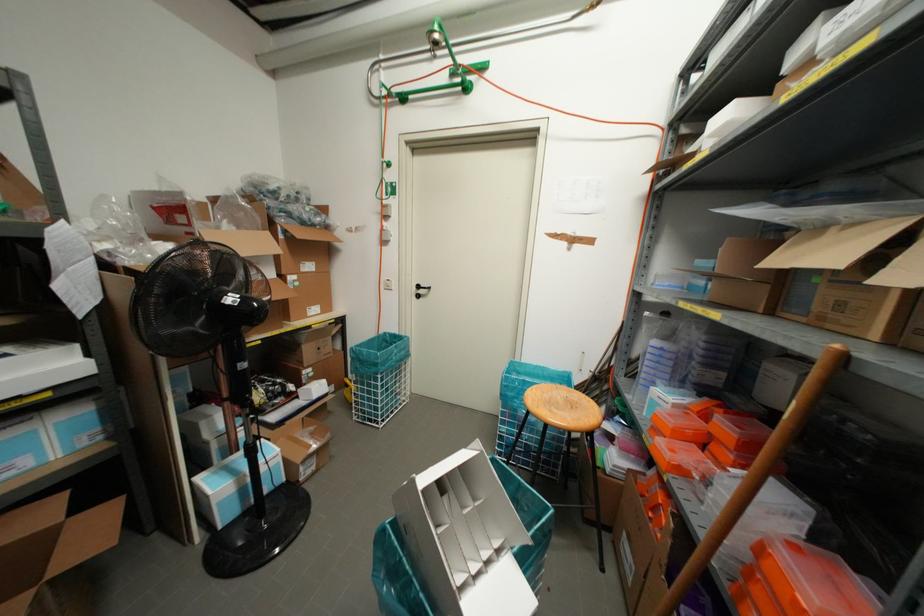
Find where to push the white light switch. Please return your answer as a coordinate pair (x, y).

(387, 284)